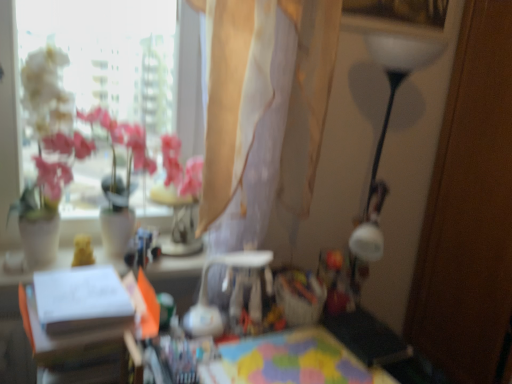
Question: Considering the positions of white paper at center, the first table viewed from the left, and multicolored fabric at center, the 2th table positioned from the left, in the image, is white paper at center, the first table viewed from the left, bigger or smaller than multicolored fabric at center, the 2th table positioned from the left,?

Choices:
 (A) small
 (B) big

Answer: (B)

Question: Is point (172, 256) positioned closer to the camera than point (269, 349)?

Choices:
 (A) closer
 (B) farther

Answer: (B)

Question: Based on their relative distances, which object is farther from the multicolored fabric at center, the 2th table positioned from the left?

Choices:
 (A) white paper at center, which is the second table in right-to-left order
 (B) translucent beige curtain at upper center

Answer: (B)

Question: Based on their relative distances, which object is farther from the multicolored fabric at center, acting as the 1th table starting from the right?

Choices:
 (A) translucent beige curtain at upper center
 (B) white paper at center, which is the second table in right-to-left order

Answer: (A)